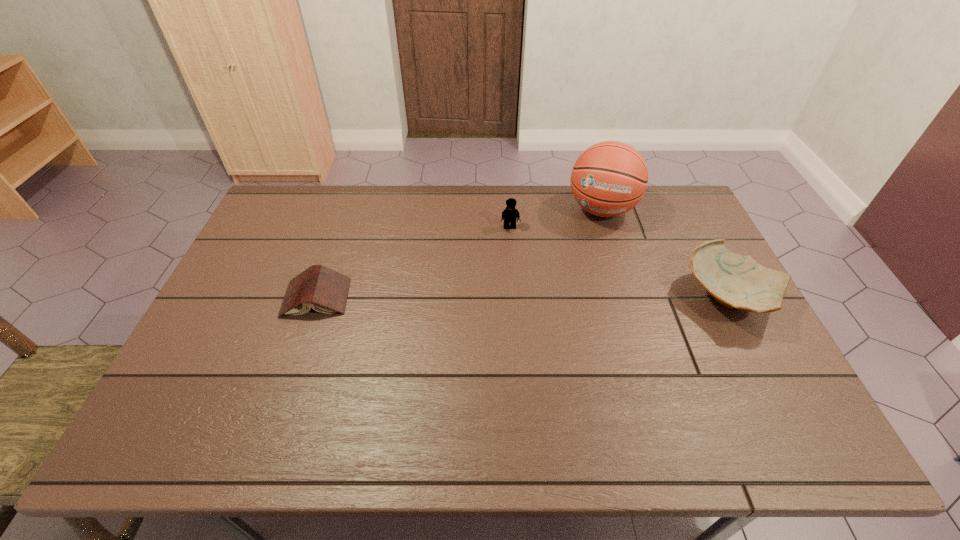
Where is `the shortest object`? The height and width of the screenshot is (540, 960). the shortest object is located at coordinates (324, 290).

Find the location of a particular element. This screenshot has width=960, height=540. book is located at coordinates (324, 290).

The image size is (960, 540). What are the coordinates of `the rightmost object` in the screenshot? It's located at pos(735,281).

I want to click on the third object from right to left, so click(x=510, y=214).

At what (x,y) coordinates should I click in order to perform the action: click on the tallest object. Please return your answer as a coordinate pair (x, y). Looking at the image, I should click on (610, 178).

At what (x,y) coordinates should I click in order to perform the action: click on basketball. Please return your answer as a coordinate pair (x, y). The image size is (960, 540). Looking at the image, I should click on (610, 178).

Identify the location of vacant space situated on the right of the book. (380, 298).

This screenshot has width=960, height=540. I want to click on free region located on the back of the pottery, so click(694, 231).

Find the location of `vacant space located on the front-facing side of the Lego`. vacant space located on the front-facing side of the Lego is located at coordinates (513, 250).

Where is `free region located 0.190m on the front-facing side of the Lego`? free region located 0.190m on the front-facing side of the Lego is located at coordinates (515, 273).